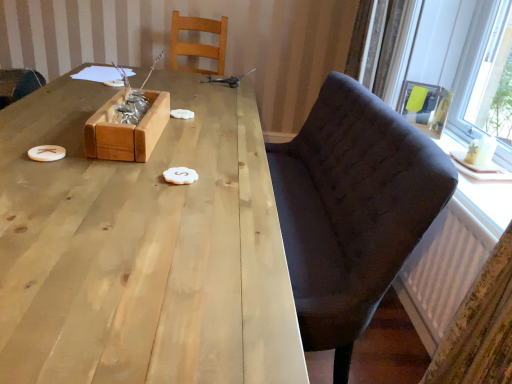
The width and height of the screenshot is (512, 384). Find the location of `free point in front of white matte cookie at center, the second food in the left-to-right sequence`. free point in front of white matte cookie at center, the second food in the left-to-right sequence is located at coordinates (165, 208).